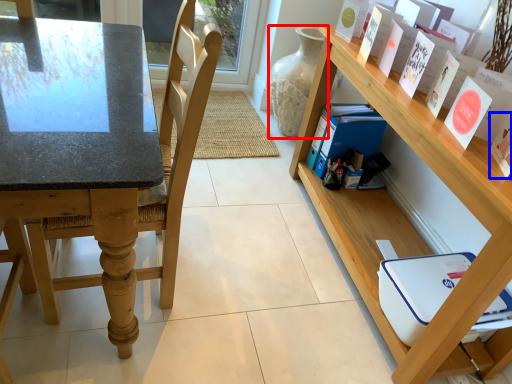
Question: Among these objects, which one is nearest to the camera, glass vase (highlighted by a red box) or paperback book (highlighted by a blue box)?

Choices:
 (A) glass vase
 (B) paperback book

Answer: (B)